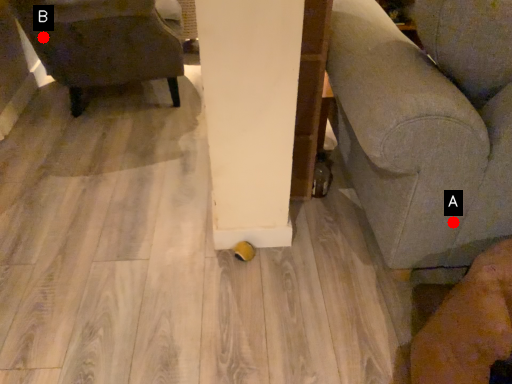
Question: Two points are circled on the image, labeled by A and B beside each circle. Which point is closer to the camera taking this photo?

Choices:
 (A) A is closer
 (B) B is closer

Answer: (A)